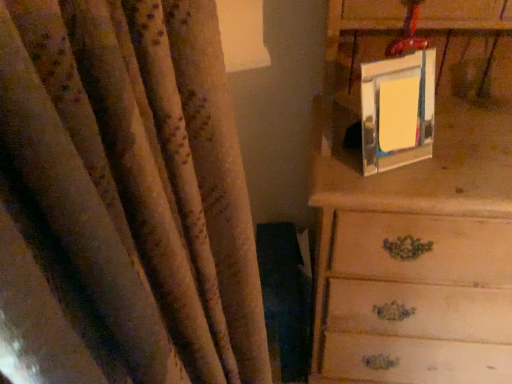
Question: Based on their positions, is wooden chest of drawers at upper right located to the left or right of metallic reflective picture frame at upper right?

Choices:
 (A) left
 (B) right

Answer: (B)

Question: Looking at the image, does wooden chest of drawers at upper right seem bigger or smaller compared to metallic reflective picture frame at upper right?

Choices:
 (A) big
 (B) small

Answer: (A)

Question: Do you think wooden chest of drawers at upper right is within metallic reflective picture frame at upper right, or outside of it?

Choices:
 (A) outside
 (B) inside

Answer: (A)

Question: From the image's perspective, is metallic reflective picture frame at upper right located above or below wooden chest of drawers at upper right?

Choices:
 (A) above
 (B) below

Answer: (A)

Question: Based on their positions, is metallic reflective picture frame at upper right located to the left or right of wooden chest of drawers at upper right?

Choices:
 (A) left
 (B) right

Answer: (A)

Question: In the image, is metallic reflective picture frame at upper right positioned in front of or behind wooden chest of drawers at upper right?

Choices:
 (A) front
 (B) behind

Answer: (B)

Question: From a real-world perspective, is metallic reflective picture frame at upper right above or below wooden chest of drawers at upper right?

Choices:
 (A) above
 (B) below

Answer: (A)